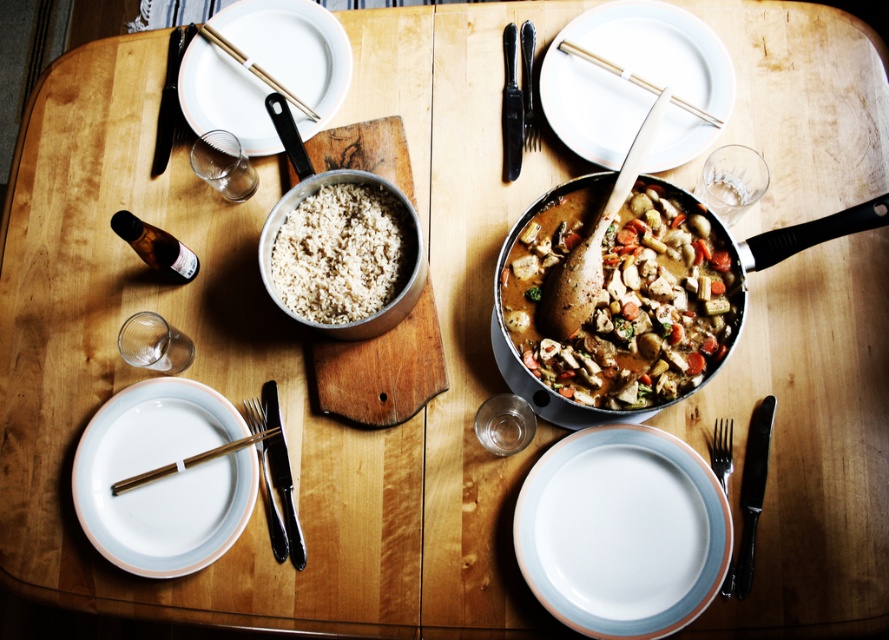
In the scene shown: You are setting the table for a guest and need to place a decorative centerpiece. The centerpiece requires a space wider than the black metal fork at lower left. Can the transparent glass at upper right accommodate this requirement?

The transparent glass at upper right has a width larger than the black metal fork at lower left, so it can accommodate the centerpiece that requires a space wider than the black metal fork at lower left.

You are a guest sitting at the dining table and want to reach for the transparent glass at upper right. Based on the coordinates provided, can you estimate its position relative to your current seat?

The transparent glass at upper right is located at coordinates point (x=733, y=180), which would place it to the right and slightly forward from your current seat at the table.

You are a guest at this dining table and want to reach for the gold metallic chopsticks at upper left. However, there is a white matte plate at upper left blocking your view. Can you easily access the chopsticks without moving the plate?

The white matte plate at upper left is further to the viewer than gold metallic chopsticks at upper left, so the plate is closer to you and blocking the chopsticks. You would need to move the plate to access the chopsticks.